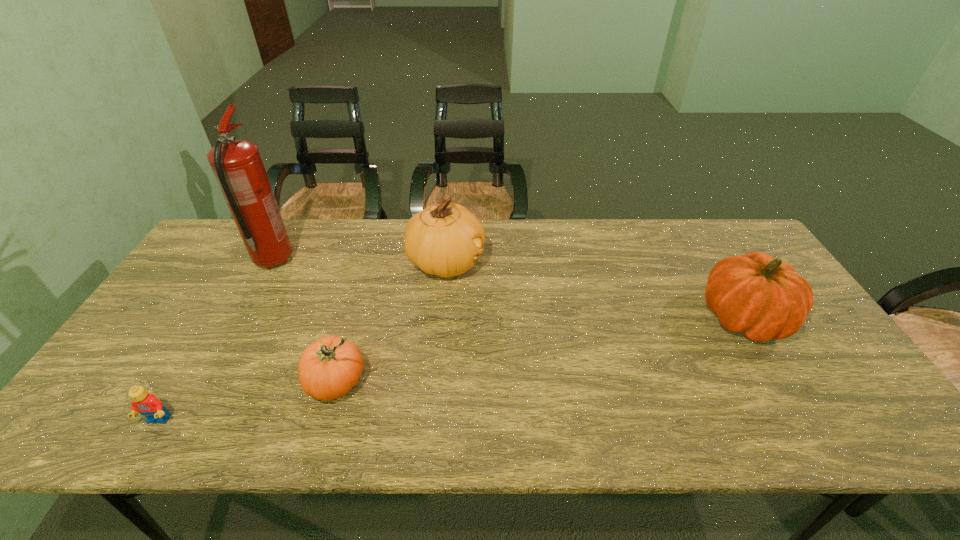
At what (x,y) coordinates should I click in order to perform the action: click on vacant space located 0.260m on the front face of the second pumpkin from left to right. Please return your answer as a coordinate pair (x, y). Looking at the image, I should click on (567, 262).

Find the location of a particular element. The image size is (960, 540). free region located 0.190m on the back of the rightmost pumpkin is located at coordinates (701, 247).

Where is `free spot located on the right of the fourth farthest object`? free spot located on the right of the fourth farthest object is located at coordinates (443, 381).

The height and width of the screenshot is (540, 960). I want to click on fire extinguisher situated at the far edge, so click(237, 165).

At what (x,y) coordinates should I click in order to perform the action: click on pumpkin at the far edge. Please return your answer as a coordinate pair (x, y). Looking at the image, I should click on (444, 240).

In order to click on pumpkin positioned at the near edge in this screenshot , I will do `click(328, 368)`.

Image resolution: width=960 pixels, height=540 pixels. Find the location of `Lego that is at the near edge`. Lego that is at the near edge is located at coordinates 145,403.

In order to click on object present at the left edge in this screenshot , I will do `click(145, 403)`.

What are the coordinates of `object at the right edge` in the screenshot? It's located at (763, 298).

At what (x,y) coordinates should I click in order to perform the action: click on object at the near left corner. Please return your answer as a coordinate pair (x, y). Looking at the image, I should click on (145, 403).